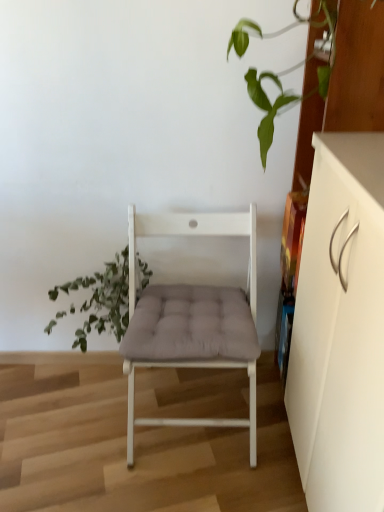
Question: Is green leafy plant at left outside white matte cabinet at right?

Choices:
 (A) no
 (B) yes

Answer: (B)

Question: Considering the relative positions of green leafy plant at left and white matte cabinet at right in the image provided, is green leafy plant at left to the right of white matte cabinet at right from the viewer's perspective?

Choices:
 (A) yes
 (B) no

Answer: (B)

Question: From a real-world perspective, is green leafy plant at left positioned under white matte cabinet at right based on gravity?

Choices:
 (A) yes
 (B) no

Answer: (A)

Question: Is white matte cabinet at right surrounded by green leafy plant at left?

Choices:
 (A) yes
 (B) no

Answer: (B)

Question: Considering the relative sizes of green leafy plant at left and white matte cabinet at right in the image provided, is green leafy plant at left bigger than white matte cabinet at right?

Choices:
 (A) yes
 (B) no

Answer: (B)

Question: Is green leafy plant at left wider or thinner than white matte chair at center?

Choices:
 (A) thin
 (B) wide

Answer: (A)

Question: Relative to white matte chair at center, is green leafy plant at left in front or behind?

Choices:
 (A) front
 (B) behind

Answer: (B)

Question: Is green leafy plant at left bigger or smaller than white matte chair at center?

Choices:
 (A) big
 (B) small

Answer: (B)

Question: Considering the positions of point (72, 343) and point (180, 307), is point (72, 343) closer or farther from the camera than point (180, 307)?

Choices:
 (A) closer
 (B) farther

Answer: (B)

Question: Looking at the image, does white matte chair at center seem bigger or smaller compared to white matte cabinet at right?

Choices:
 (A) small
 (B) big

Answer: (A)

Question: Is point (134, 420) positioned closer to the camera than point (340, 456)?

Choices:
 (A) closer
 (B) farther

Answer: (B)

Question: Considering the positions of white matte chair at center and white matte cabinet at right in the image, is white matte chair at center taller or shorter than white matte cabinet at right?

Choices:
 (A) tall
 (B) short

Answer: (B)

Question: Is white matte chair at center wider or thinner than white matte cabinet at right?

Choices:
 (A) thin
 (B) wide

Answer: (B)

Question: Considering the positions of green leafy plant at left and white matte cabinet at right in the image, is green leafy plant at left bigger or smaller than white matte cabinet at right?

Choices:
 (A) big
 (B) small

Answer: (B)

Question: Does point (97, 293) appear closer or farther from the camera than point (349, 279)?

Choices:
 (A) farther
 (B) closer

Answer: (A)